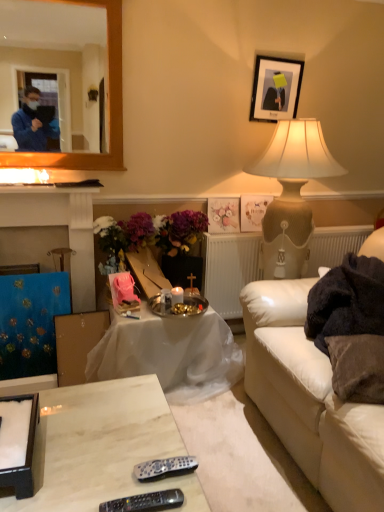
Question: From the image's perspective, would you say black plastic remote at lower center, which is the 2th remote in back-to-front order, is positioned over white leather couch at lower right?

Choices:
 (A) yes
 (B) no

Answer: (B)

Question: From a real-world perspective, does black plastic remote at lower center, the 1th remote viewed from the front, stand above white leather couch at lower right?

Choices:
 (A) no
 (B) yes

Answer: (A)

Question: Does black plastic remote at lower center, the 1th remote viewed from the front, appear on the left side of white leather couch at lower right?

Choices:
 (A) yes
 (B) no

Answer: (A)

Question: Does black plastic remote at lower center, which is the 2th remote in back-to-front order, have a greater width compared to white leather couch at lower right?

Choices:
 (A) yes
 (B) no

Answer: (B)

Question: Is black plastic remote at lower center, which is the 2th remote in back-to-front order, next to white leather couch at lower right?

Choices:
 (A) yes
 (B) no

Answer: (B)

Question: Considering their positions, is marble remote control at lower center, the first table when ordered from front to back, located in front of or behind white textured radiator at center?

Choices:
 (A) behind
 (B) front

Answer: (B)

Question: Visually, is marble remote control at lower center, the 2th table from the back, positioned to the left or to the right of white textured radiator at center?

Choices:
 (A) right
 (B) left

Answer: (B)

Question: From the image's perspective, is marble remote control at lower center, the first table when ordered from front to back, above or below white textured radiator at center?

Choices:
 (A) below
 (B) above

Answer: (A)

Question: Is point (74, 506) positioned closer to the camera than point (231, 312)?

Choices:
 (A) closer
 (B) farther

Answer: (A)

Question: In terms of size, does black plastic remote at lower center, the 1th remote viewed from the front, appear bigger or smaller than white leather couch at lower right?

Choices:
 (A) big
 (B) small

Answer: (B)

Question: In terms of width, does black plastic remote at lower center, which is the 2th remote in back-to-front order, look wider or thinner when compared to white leather couch at lower right?

Choices:
 (A) thin
 (B) wide

Answer: (A)

Question: From a real-world perspective, is black plastic remote at lower center, which is the 2th remote in back-to-front order, physically located above or below white leather couch at lower right?

Choices:
 (A) above
 (B) below

Answer: (B)

Question: Does point (148, 500) appear closer or farther from the camera than point (362, 461)?

Choices:
 (A) closer
 (B) farther

Answer: (A)

Question: Is white textured radiator at center in front of or behind white paper picture frame at upper center, the second picture frame in the bottom-to-top sequence, in the image?

Choices:
 (A) behind
 (B) front

Answer: (B)

Question: From the image's perspective, is white textured radiator at center located above or below white paper picture frame at upper center, acting as the 2th picture frame starting from the top?

Choices:
 (A) above
 (B) below

Answer: (B)